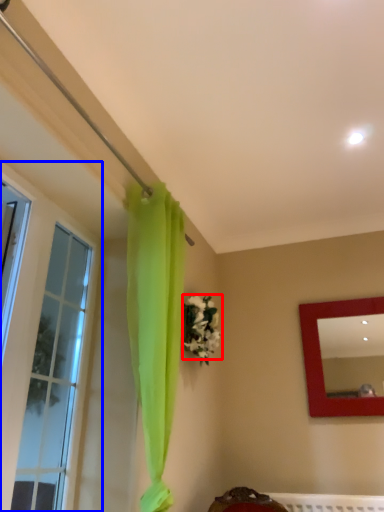
Question: Which object is closer to the camera taking this photo, flower (highlighted by a red box) or window (highlighted by a blue box)?

Choices:
 (A) flower
 (B) window

Answer: (B)